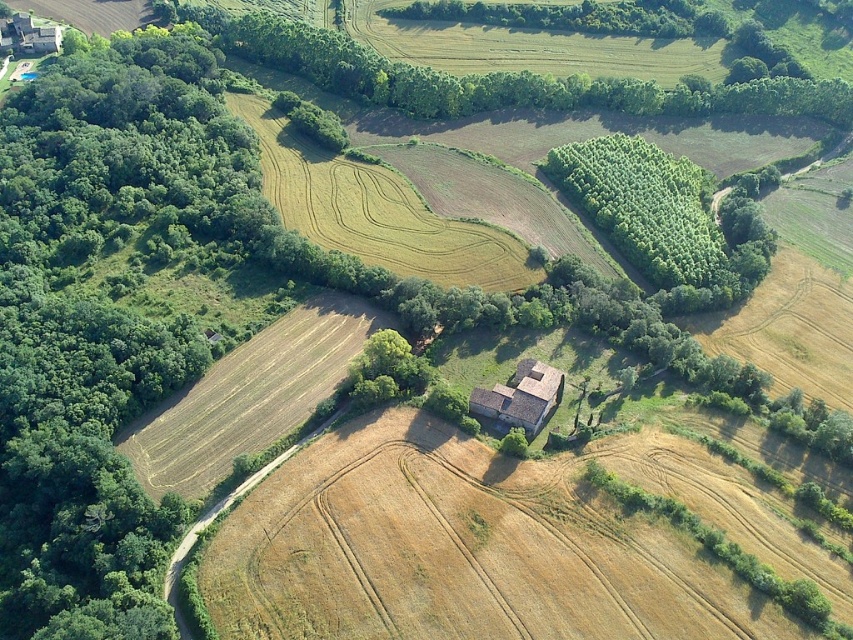
Image resolution: width=853 pixels, height=640 pixels. What do you see at coordinates (643, 208) in the screenshot? I see `green leafy trees at center-right` at bounding box center [643, 208].

Does green leafy trees at center-right appear under brown stone barn at center?

No, green leafy trees at center-right is not below brown stone barn at center.

You are a GUI agent. You are given a task and a screenshot of the screen. Output one action in this format:
    pyautogui.click(x=<x>, y=<y>)
    Task: Click on the green leafy trees at center-right
    The width and height of the screenshot is (853, 640).
    Given the screenshot: What is the action you would take?
    pyautogui.click(x=643, y=208)

Where is `green leafy trees at center-right`? This screenshot has width=853, height=640. green leafy trees at center-right is located at coordinates click(643, 208).